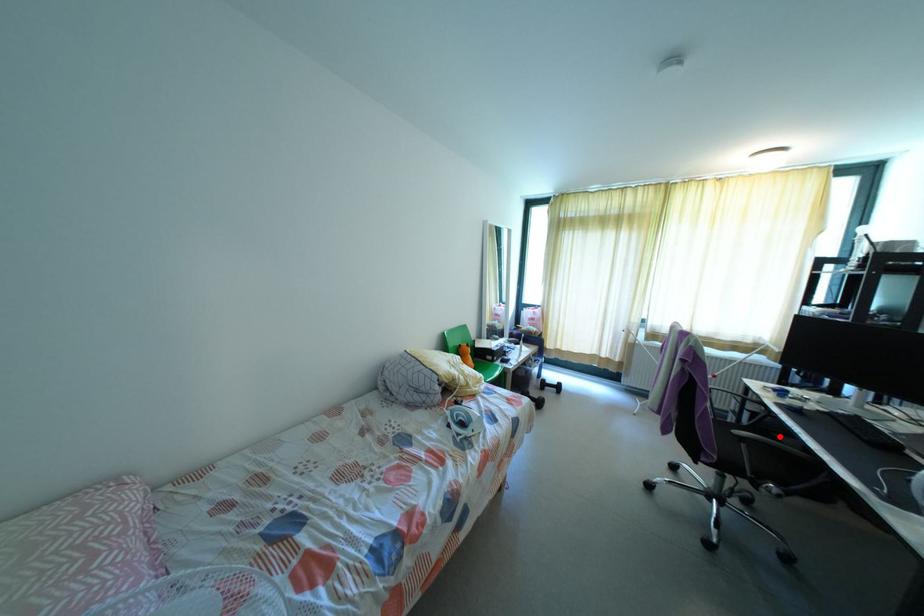
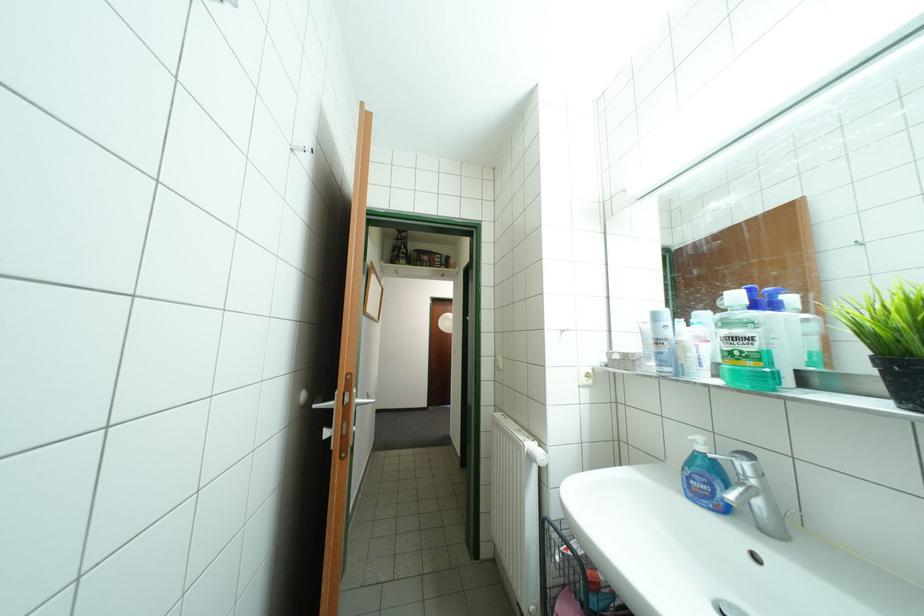
Question: I am providing you with two images of the same scene from different viewpoints. A red point is marked on the first image. Is the red point's position out of view in image 2?

Choices:
 (A) Yes
 (B) No

Answer: (A)